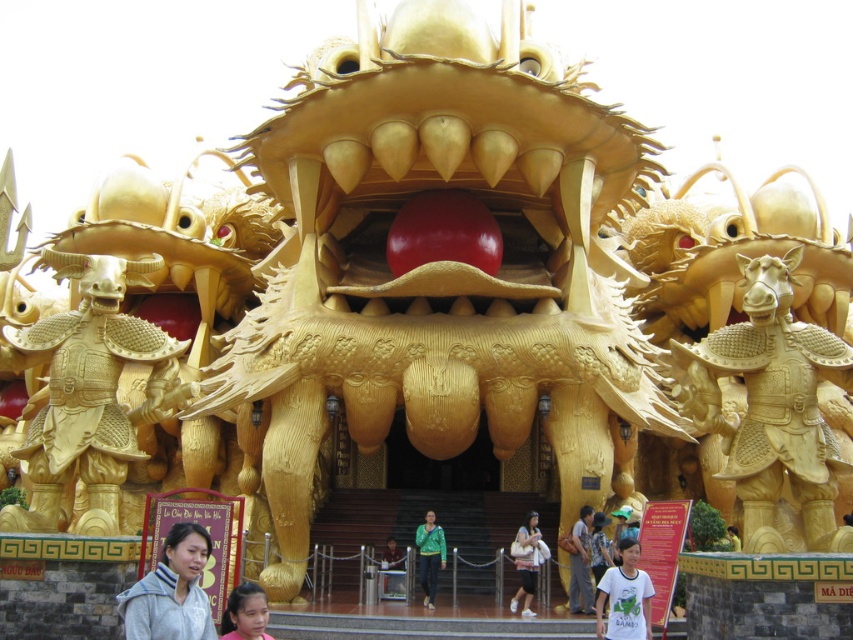
You are an architect designing a new entranceway and want to replicate the symmetry seen in the image. Given the gold textured dragon head at center and the gold textured armor at right, which object should be placed higher to maintain the symmetry?

To maintain symmetry, the gold textured dragon head at center should be placed higher since it is located above the gold textured armor at right in the original design.